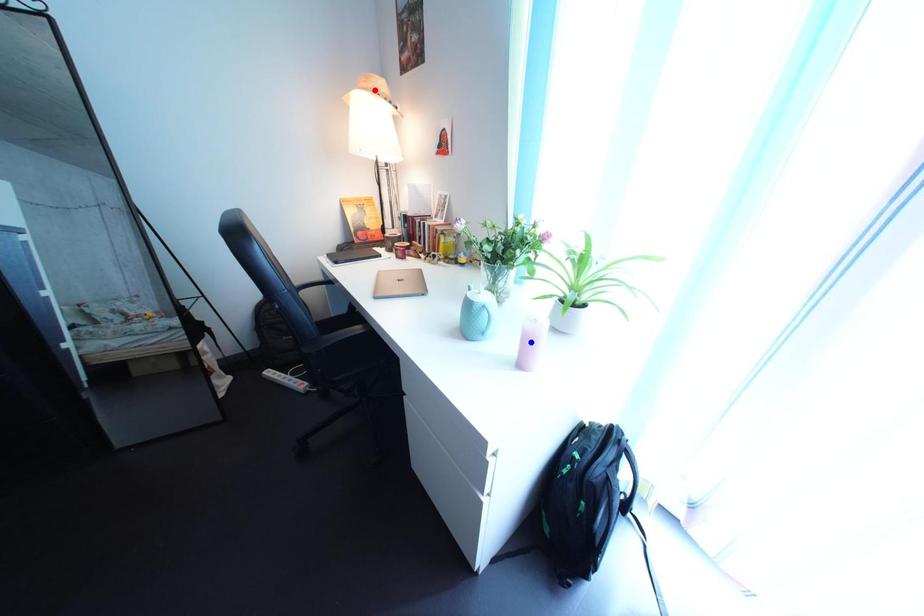
Question: In the image, two points are highlighted. Which point is nearer to the camera? Reply with the corresponding letter.

Choices:
 (A) blue point
 (B) red point

Answer: (A)